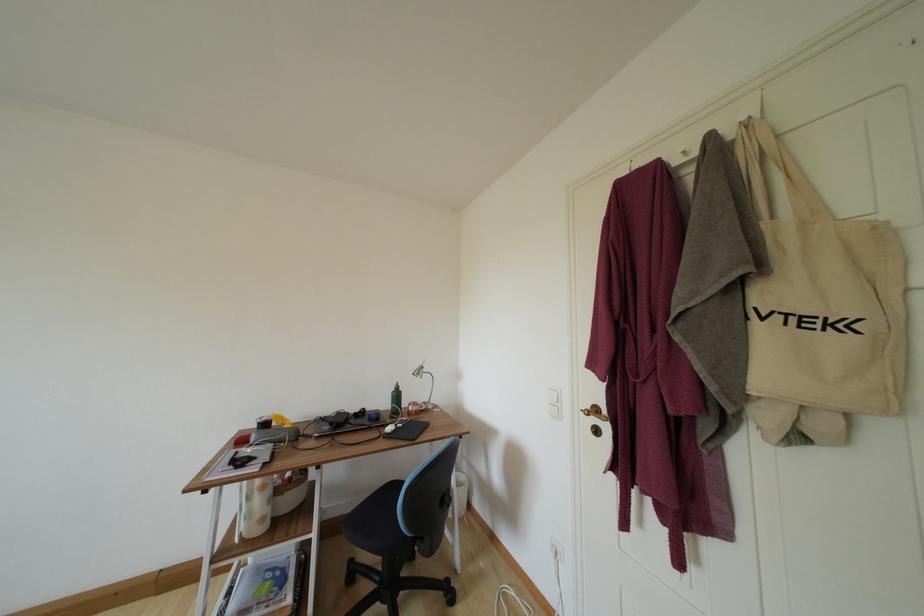
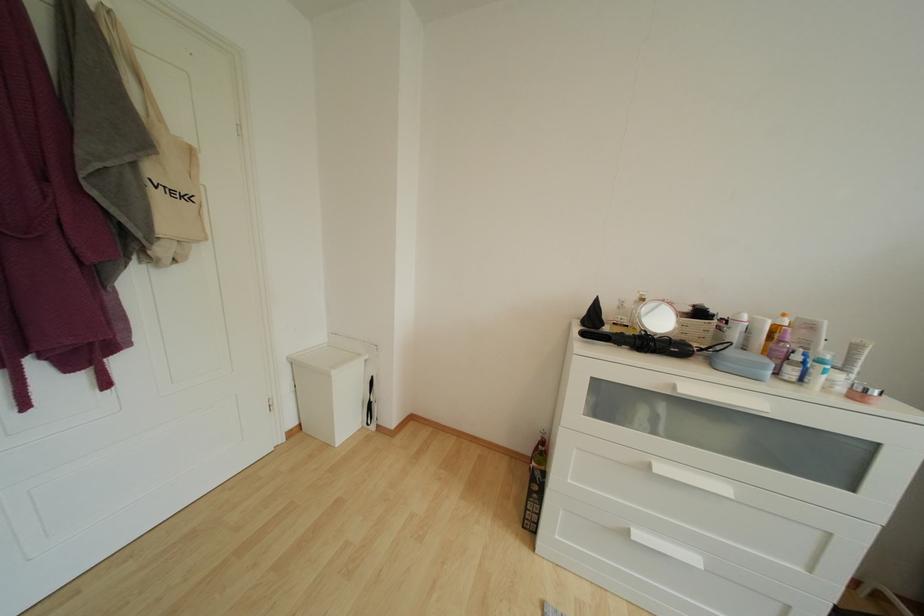
Where in the second image is the point corresponding to (751,128) from the first image?

(114, 15)